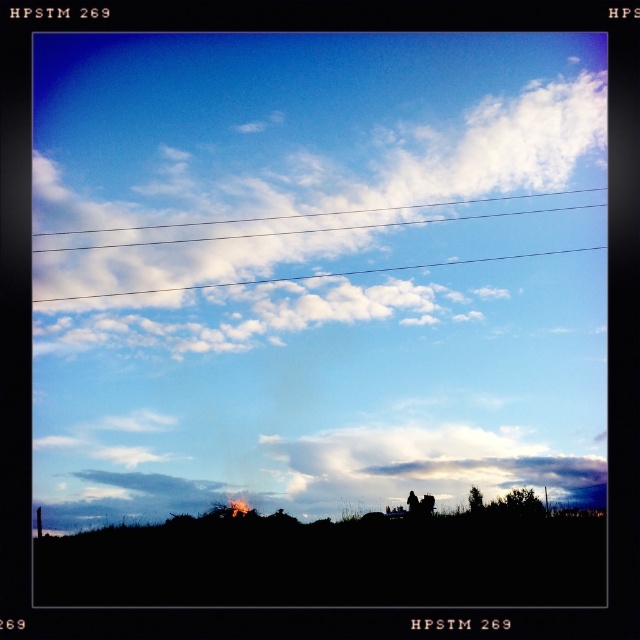
You are an astronomer observing the sky in the image. You notice the white fluffy cloud at upper center. Based on its position, can you determine if it is closer to the top edge or the bottom edge of the sky area?

The white fluffy cloud at upper center is located at point (316, 212). Since the y coordinate is approximately 0.494, which is nearly halfway between the top and bottom edges of the sky area, it is positioned closer to the bottom edge of the sky area.

You are a drone operator trying to map the terrain. The coordinate system is normalized, with the origin at the bottom left corner of the image. The black matte hillside at lower center is located at which coordinate?

The black matte hillside at lower center is located at coordinate point (332, 560).

You are an observer looking at the scene. Which object, the black matte hillside at lower center or the white fluffy cloud at upper center, takes up less space in the image?

The black matte hillside at lower center has a smaller size compared to the white fluffy cloud at upper center, so it takes up less space in the image.